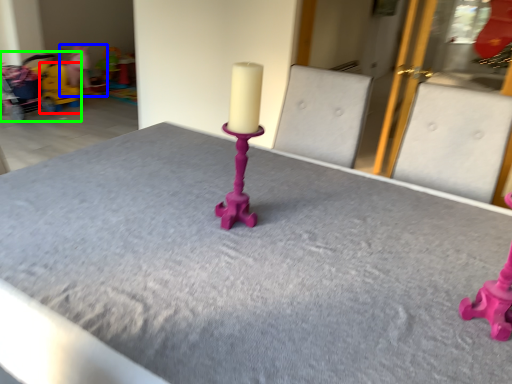
Question: Which object is the farthest from toy (highlighted by a red box)? Choose among these: toy (highlighted by a blue box) or baby carriage (highlighted by a green box).

Choices:
 (A) toy
 (B) baby carriage

Answer: (A)